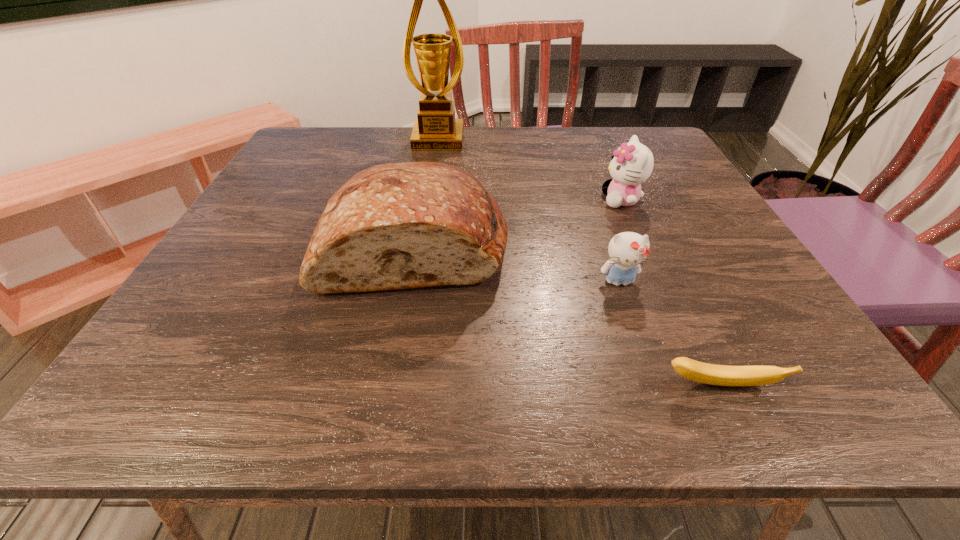
Where is `award`? award is located at coordinates (436, 129).

Where is `the tallest object`? the tallest object is located at coordinates (436, 129).

At what (x,y) coordinates should I click in order to perform the action: click on the second tallest object. Please return your answer as a coordinate pair (x, y). This screenshot has height=540, width=960. Looking at the image, I should click on (405, 225).

The image size is (960, 540). What are the coordinates of `the third tallest object` in the screenshot? It's located at (632, 163).

The height and width of the screenshot is (540, 960). Identify the location of the farther kitten. click(632, 163).

The width and height of the screenshot is (960, 540). In order to click on the second shortest object in this screenshot , I will do `click(627, 250)`.

Locate an element on the screen. The image size is (960, 540). the nearer kitten is located at coordinates (627, 250).

This screenshot has width=960, height=540. Identify the location of banana. (722, 375).

Find the location of a particular element. The image size is (960, 540). the shortest object is located at coordinates (722, 375).

Where is `vacant space located on the front-facing side of the farthest object`? The width and height of the screenshot is (960, 540). vacant space located on the front-facing side of the farthest object is located at coordinates (432, 180).